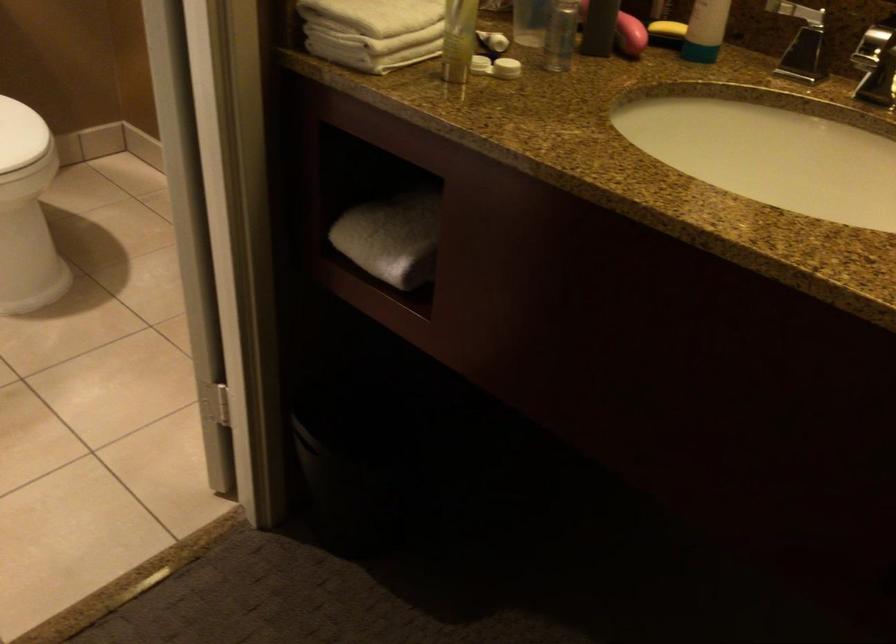
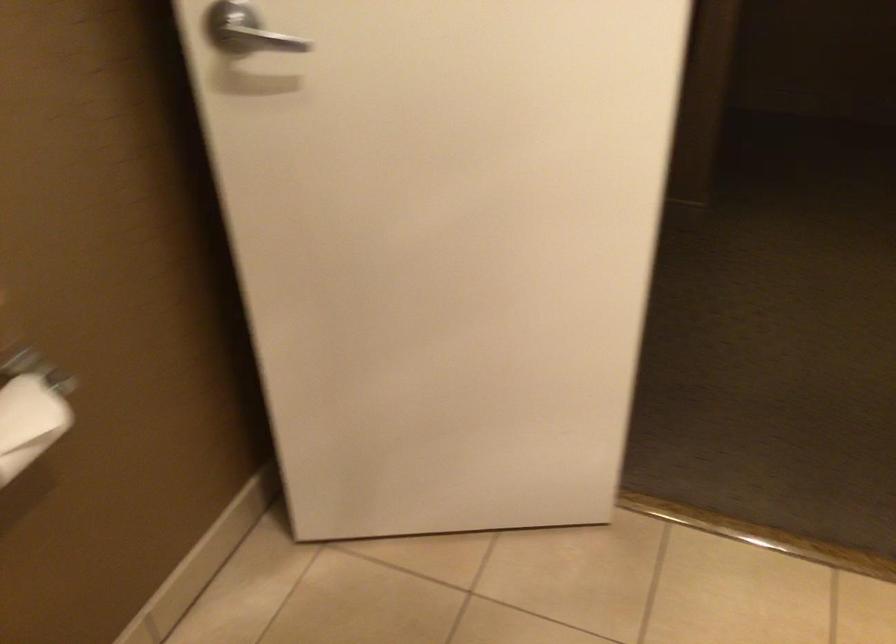
Question: I am providing you with two images of the same scene from different viewpoints. Please identify which objects are invisible in image2.

Choices:
 (A) white plastic box
 (B) silver door handle
 (C) rolled white towel
 (D) toilet paper roll

Answer: (C)